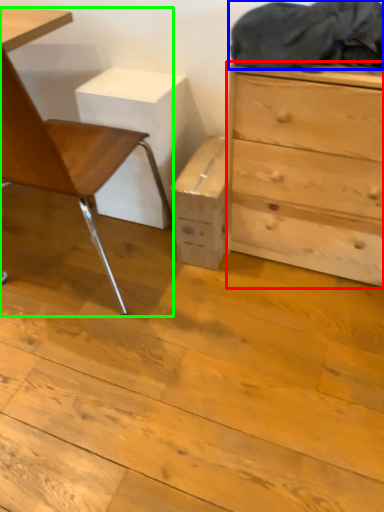
Question: Considering the real-world distances, which object is farthest from chest of drawers (highlighted by a red box)? laundry (highlighted by a blue box) or chair (highlighted by a green box)?

Choices:
 (A) laundry
 (B) chair

Answer: (B)